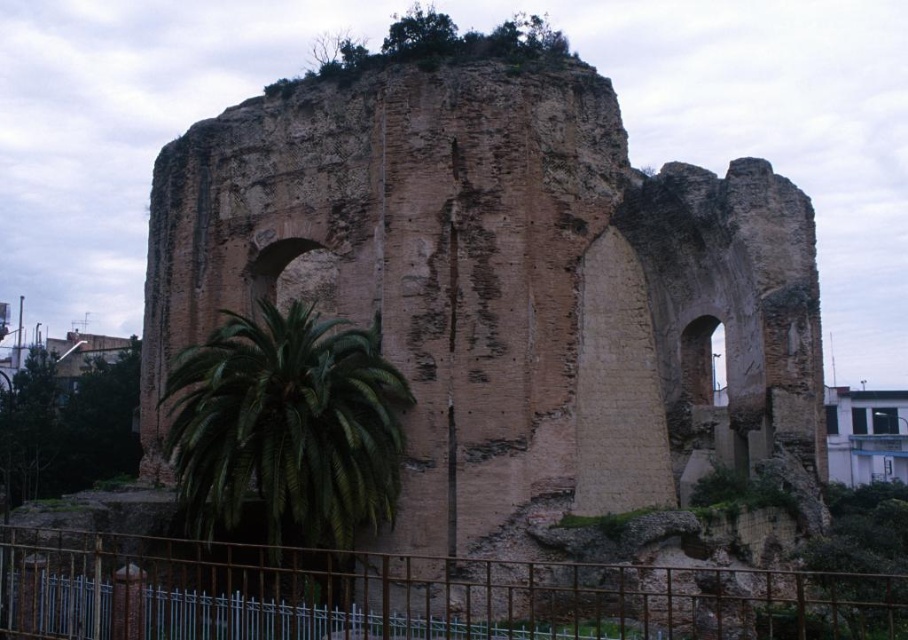
You are standing in front of the brown stone ruins at center and the green leafy palm at lower left. Which object is positioned to the left of the other?

The green leafy palm at lower left is to the left of the brown stone ruins at center.

From the picture: You are a photographer planning to capture the brown stone ruins at center and the rusty metal fence at lower left in a single frame. Given that your camera can only focus on objects within a 10m height range, will both objects fit within this range if the ruins are taller than the fence?

The brown stone ruins at center has a greater height compared to rusty metal fence at lower left, so if the ruins are within the 10m height range, the fence will also fit since it is shorter. However, if the ruins exceed 10m, the fence might still be within range depending on its actual height.